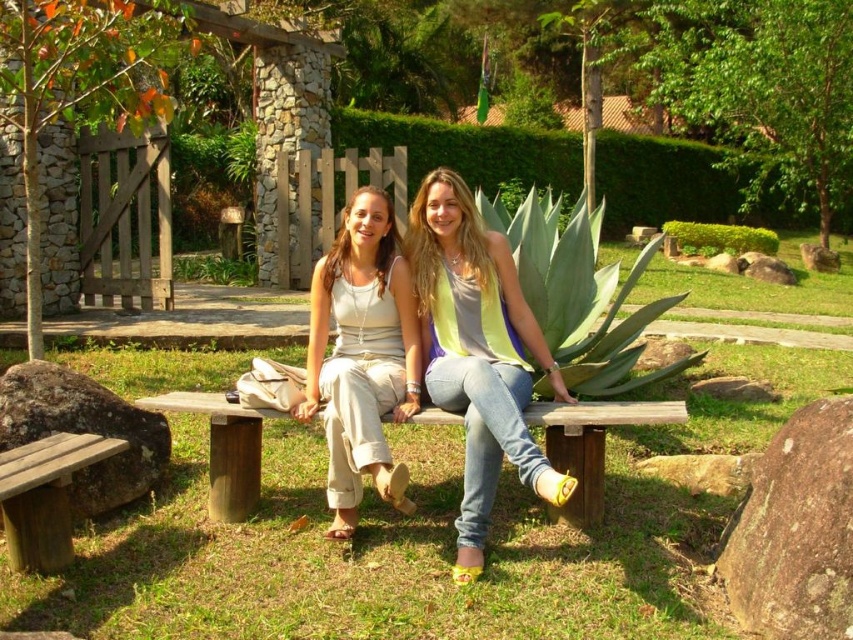
Consider the image. Can you confirm if brown rough rock at lower right is taller than brown wooden bench at lower left?

Yes.

Can you confirm if brown rough rock at lower right is wider than brown wooden bench at lower left?

No, brown rough rock at lower right is not wider than brown wooden bench at lower left.

Describe the element at coordinates (796, 531) in the screenshot. I see `brown rough rock at lower right` at that location.

Locate an element on the screen. The image size is (853, 640). brown rough rock at lower right is located at coordinates (796, 531).

Does brown rough rock at lower right have a lesser width compared to wooden bench at lower left?

Incorrect, brown rough rock at lower right's width is not less than wooden bench at lower left's.

Which is behind, point (822, 579) or point (6, 529)?

The point (6, 529) is more distant.

Between point (751, 586) and point (12, 564), which one is positioned behind?

The point (12, 564) is behind.

In order to click on brown rough rock at lower right in this screenshot , I will do `click(796, 531)`.

Does beige cotton tank top at center have a smaller size compared to wooden bench at lower left?

Incorrect, beige cotton tank top at center is not smaller in size than wooden bench at lower left.

Does point (379, 259) come closer to viewer compared to point (22, 480)?

No, (379, 259) is behind (22, 480).

Who is more distant from viewer, (x=311, y=358) or (x=42, y=477)?

The point (x=311, y=358) is behind.

Locate an element on the screen. The width and height of the screenshot is (853, 640). beige cotton tank top at center is located at coordinates (363, 355).